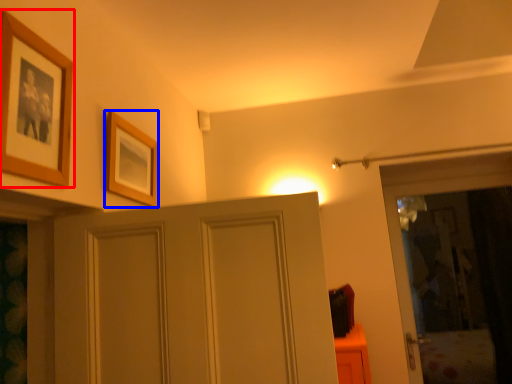
Question: Which of the following is the closest to the observer, picture frame (highlighted by a red box) or picture frame (highlighted by a blue box)?

Choices:
 (A) picture frame
 (B) picture frame

Answer: (A)